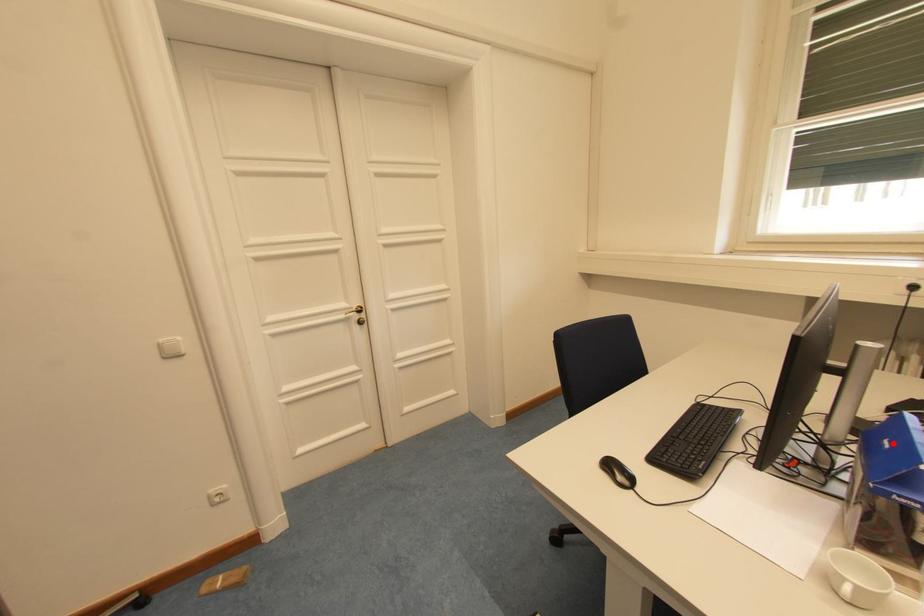
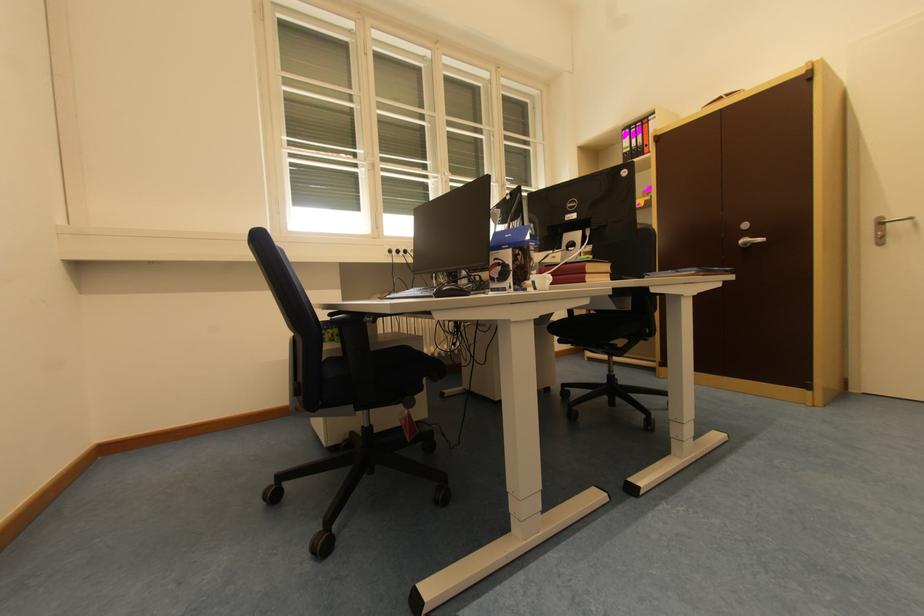
The point at the highlighted location is marked in the first image. Where is the corresponding point in the second image?

(514, 238)